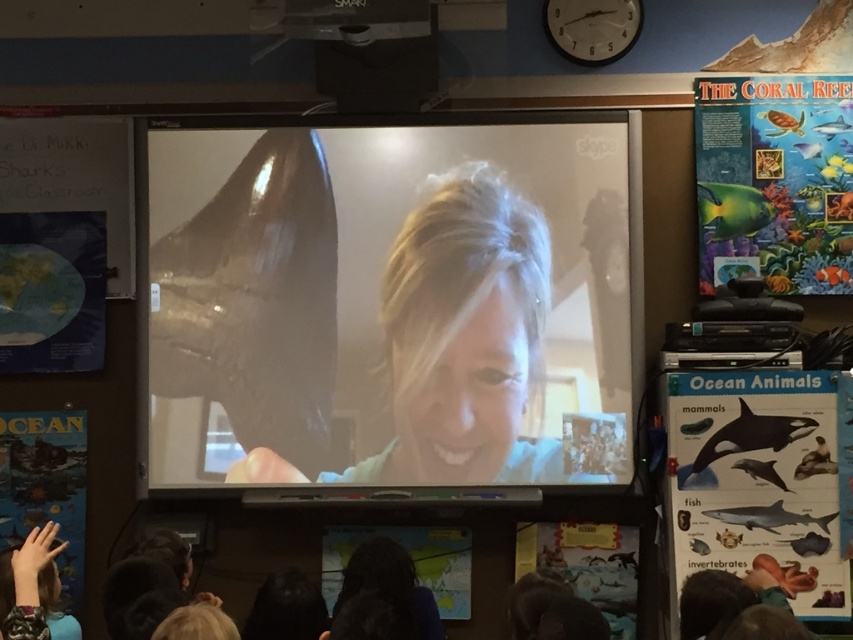
From the picture: You are a teacher in the classroom. You need to hang a new poster that is the same size as the widest object between the matte paper ocean animals chart at right and the matte paper poster at lower center. Which object should you measure to ensure the new poster fits properly?

The matte paper ocean animals chart at right is wider than the matte paper poster at lower center, so you should measure the matte paper ocean animals chart at right to ensure the new poster fits properly.